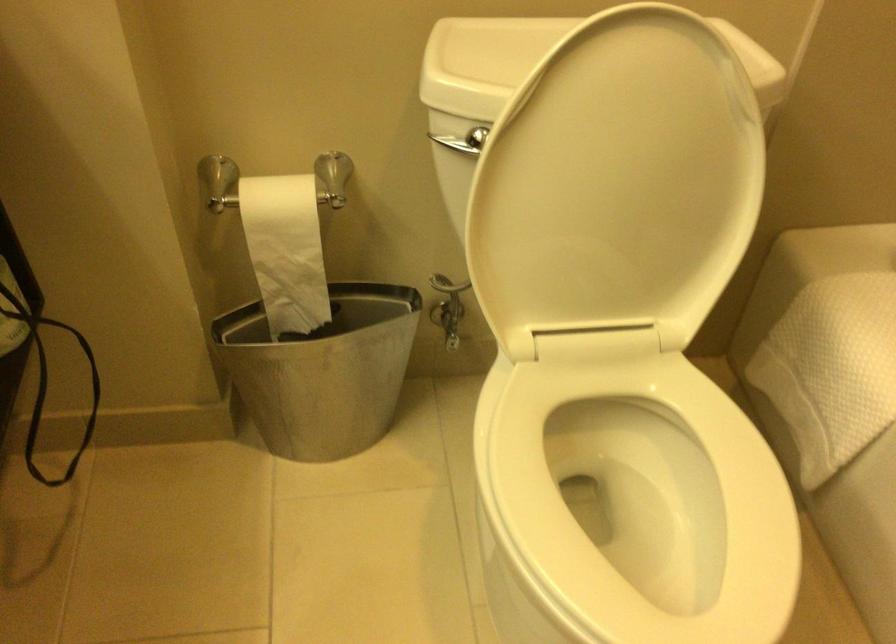
Describe the element at coordinates (617, 183) in the screenshot. This screenshot has height=644, width=896. I see `the white toilet lid` at that location.